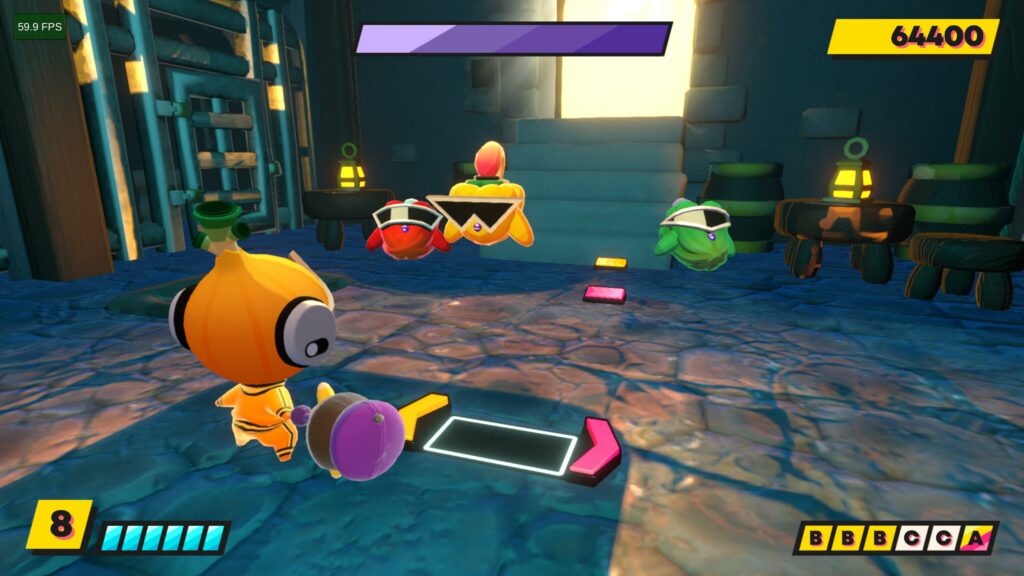
Locate an element on the screen. This screenshot has height=576, width=1024. stone floor is located at coordinates (680, 371).